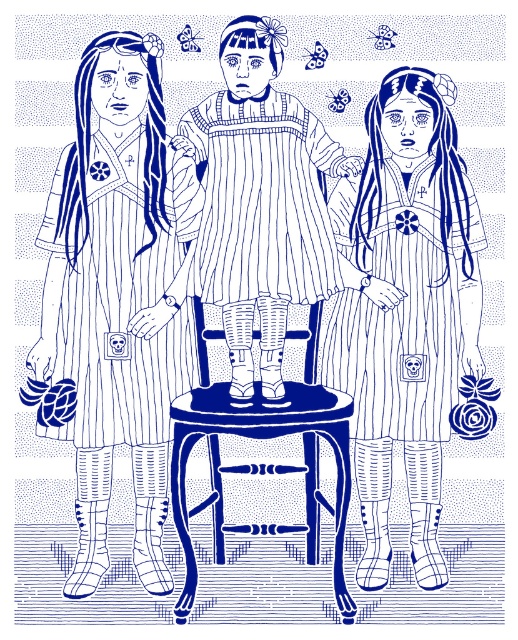
Question: Does matte striped dress at center appear under striped fabric dress at left?

Choices:
 (A) yes
 (B) no

Answer: (A)

Question: Is striped fabric apron at center smaller than wooden chair at center?

Choices:
 (A) no
 (B) yes

Answer: (B)

Question: Among these objects, which one is farthest from the camera?

Choices:
 (A) striped fabric apron at center
 (B) wooden chair at center
 (C) matte striped dress at center
 (D) striped fabric dress at left

Answer: (C)

Question: Among these points, which one is farthest from the camera?

Choices:
 (A) (307, 472)
 (B) (130, 268)

Answer: (A)

Question: Among these points, which one is nearest to the camera?

Choices:
 (A) [436, 392]
 (B) [309, 474]

Answer: (A)

Question: Can you confirm if matte striped dress at center is positioned below striped fabric apron at center?

Choices:
 (A) no
 (B) yes

Answer: (B)